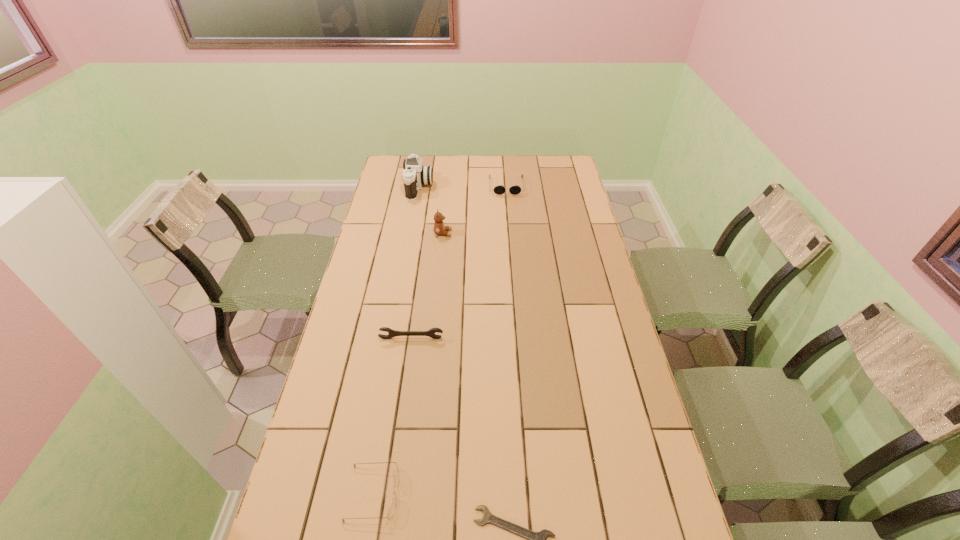
At what (x,y) coordinates should I click in order to perform the action: click on free space at the right edge of the desktop. Please return your answer as a coordinate pair (x, y). Looking at the image, I should click on (602, 344).

Locate an element on the screen. The image size is (960, 540). vacant space at the far right corner of the desktop is located at coordinates (551, 171).

The width and height of the screenshot is (960, 540). I want to click on free point between the sunglasses and the camera, so point(463,187).

You are a GUI agent. You are given a task and a screenshot of the screen. Output one action in this format:
    pyautogui.click(x=<x>, y=<y>)
    Task: Click on the free space between the farther wrench and the camera
    The height and width of the screenshot is (540, 960).
    Given the screenshot: What is the action you would take?
    pyautogui.click(x=415, y=263)

Locate an element on the screen. The image size is (960, 540). unoccupied position between the spectacles and the camera is located at coordinates (396, 340).

Find the location of a particular element. This screenshot has width=960, height=540. vacant area between the sunglasses and the fourth farthest object is located at coordinates (459, 262).

Locate an element on the screen. vacant area that lies between the second tallest object and the camera is located at coordinates (431, 210).

Locate an element on the screen. unoccupied area between the fourth farthest object and the tallest object is located at coordinates (415, 263).

Image resolution: width=960 pixels, height=540 pixels. Find the location of `free spot between the fourth nearest object and the fifth tallest object`. free spot between the fourth nearest object and the fifth tallest object is located at coordinates (408, 363).

The height and width of the screenshot is (540, 960). I want to click on free space between the fifth tallest object and the camera, so click(396, 340).